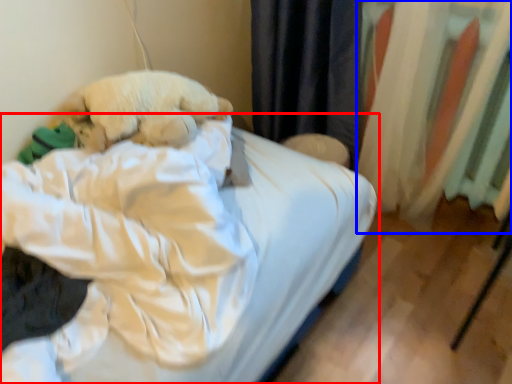
Question: Among these objects, which one is nearest to the camera, bed (highlighted by a red box) or curtain (highlighted by a blue box)?

Choices:
 (A) bed
 (B) curtain

Answer: (A)